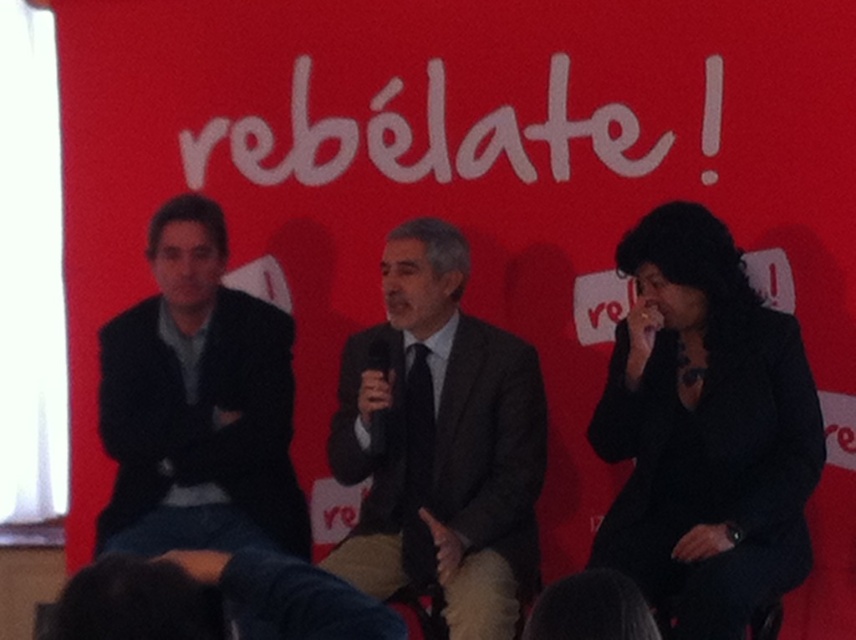
Question: Is dark gray suit at left positioned in front of white matte text at center?

Choices:
 (A) no
 (B) yes

Answer: (B)

Question: Does dark gray suit at center appear over dark gray suit at left?

Choices:
 (A) no
 (B) yes

Answer: (A)

Question: Which point is closer to the camera?

Choices:
 (A) (604, 545)
 (B) (661, 150)

Answer: (A)

Question: Which point appears farthest from the camera in this image?

Choices:
 (A) (349, 426)
 (B) (708, 358)
 (C) (189, 202)
 (D) (468, 170)

Answer: (D)

Question: Among these points, which one is nearest to the camera?

Choices:
 (A) (159, 317)
 (B) (525, 480)
 (C) (651, 304)
 (D) (229, 132)

Answer: (C)

Question: Is black fabric at right closer to the viewer compared to dark gray suit at center?

Choices:
 (A) no
 (B) yes

Answer: (B)